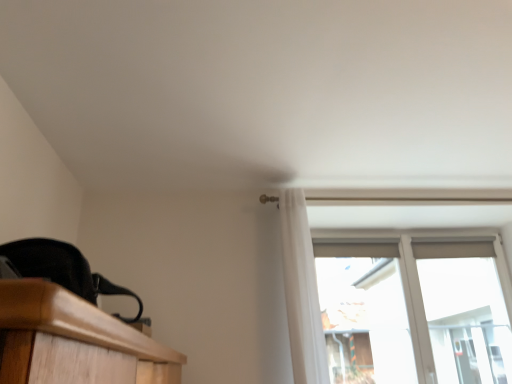
Question: Considering the relative positions of transparent glass window at upper right and white sheer curtain at upper center in the image provided, is transparent glass window at upper right to the left or to the right of white sheer curtain at upper center?

Choices:
 (A) left
 (B) right

Answer: (B)

Question: From a real-world perspective, is transparent glass window at upper right above or below white sheer curtain at upper center?

Choices:
 (A) above
 (B) below

Answer: (B)

Question: Considering the positions of transparent glass window at upper right and white sheer curtain at upper center in the image, is transparent glass window at upper right wider or thinner than white sheer curtain at upper center?

Choices:
 (A) thin
 (B) wide

Answer: (A)

Question: Is white sheer curtain at upper center wider or thinner than transparent glass window at upper right?

Choices:
 (A) thin
 (B) wide

Answer: (B)

Question: Visually, is white sheer curtain at upper center positioned to the left or to the right of transparent glass window at upper right?

Choices:
 (A) right
 (B) left

Answer: (B)

Question: From the image's perspective, is white sheer curtain at upper center located above or below transparent glass window at upper right?

Choices:
 (A) above
 (B) below

Answer: (A)

Question: From their relative heights in the image, would you say white sheer curtain at upper center is taller or shorter than transparent glass window at upper right?

Choices:
 (A) tall
 (B) short

Answer: (B)